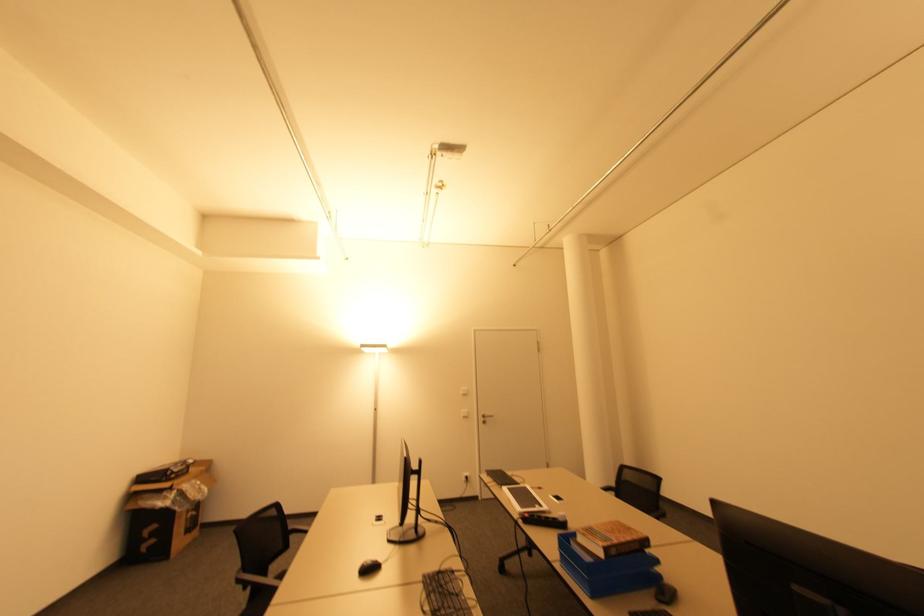
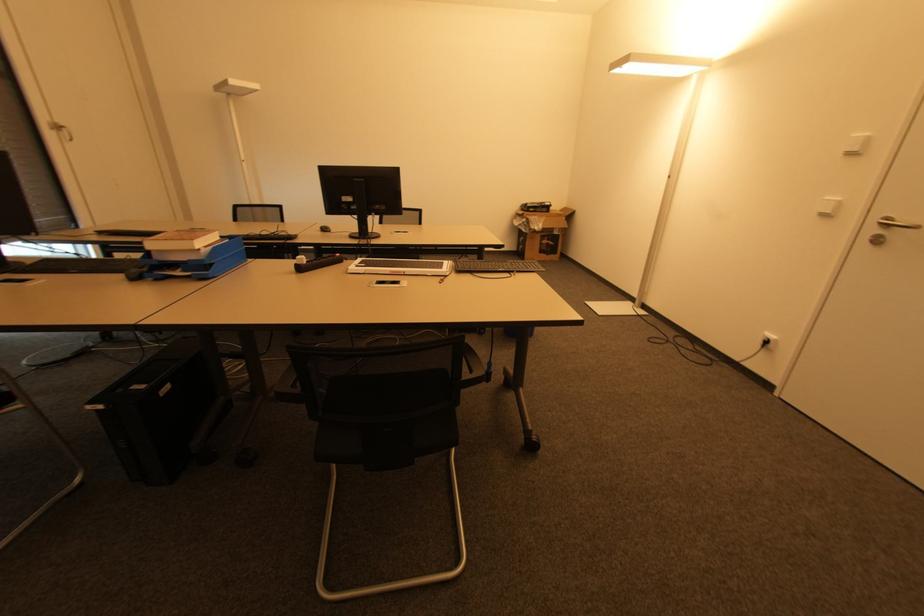
In the second image, find the point that corresponds to pixel 468 415 in the first image.

(832, 214)